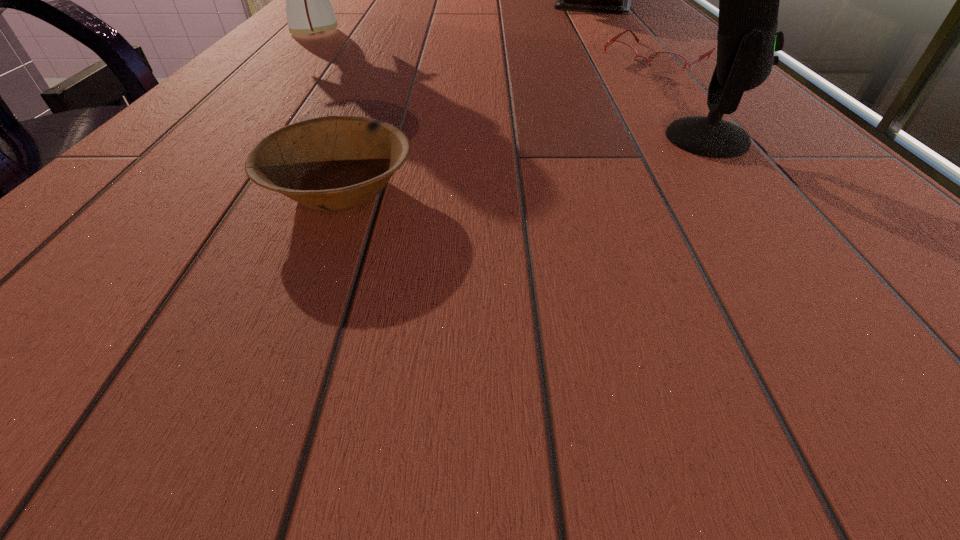
Where is `vacant space at the right edge of the desktop`? The height and width of the screenshot is (540, 960). vacant space at the right edge of the desktop is located at coordinates (632, 65).

Locate an element on the screen. The height and width of the screenshot is (540, 960). free spot between the second shortest object and the shortest object is located at coordinates (498, 125).

Where is `free space between the leftmost object and the shortest object`? Image resolution: width=960 pixels, height=540 pixels. free space between the leftmost object and the shortest object is located at coordinates [486, 46].

Locate an element on the screen. vacant point located between the microphone and the leftmost object is located at coordinates (511, 85).

Point out which object is positioned as the fourth nearest to the doll. Please provide its 2D coordinates. Your answer should be formatted as a tuple, i.e. [(x, y)], where the tuple contains the x and y coordinates of a point satisfying the conditions above.

[(749, 0)]

Locate an element on the screen. object that stands as the third closest to the fourth tallest object is located at coordinates (308, 8).

Locate an element on the screen. The image size is (960, 540). vacant space that satisfies the following two spatial constraints: 1. on the front side of the microphone; 2. on the left side of the doll is located at coordinates (218, 139).

Find the location of `free space that satisfies the following two spatial constraints: 1. on the front side of the tallest object; 2. on the left side of the shortest object`. free space that satisfies the following two spatial constraints: 1. on the front side of the tallest object; 2. on the left side of the shortest object is located at coordinates (289, 60).